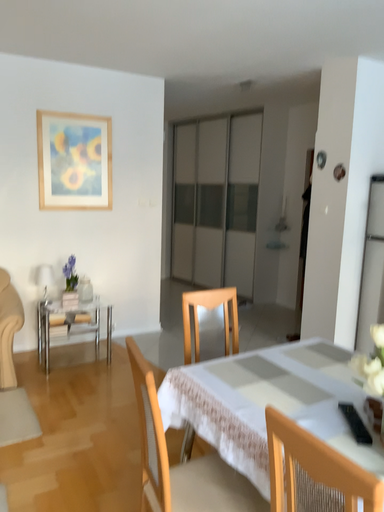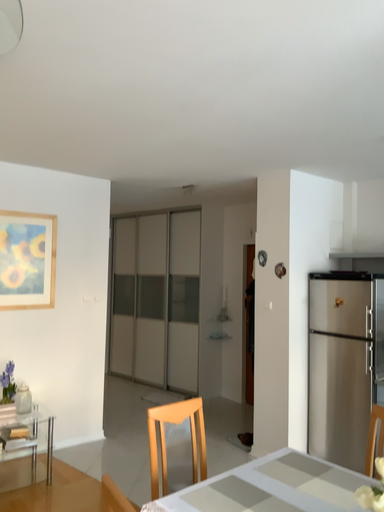
Question: How did the camera likely rotate when shooting the video?

Choices:
 (A) rotated upward
 (B) rotated downward

Answer: (A)